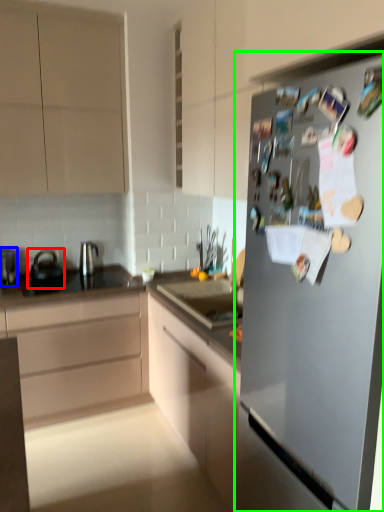
Question: Which is nearer to the tea pot (highlighted by a red box)? kitchen appliance (highlighted by a blue box) or refrigerator (highlighted by a green box).

Choices:
 (A) kitchen appliance
 (B) refrigerator

Answer: (A)